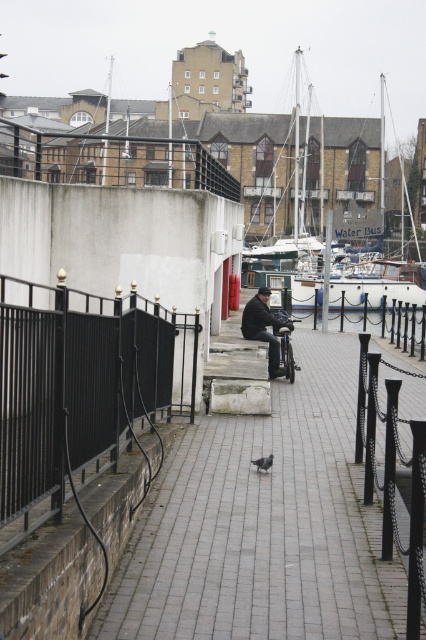
Question: Which of the following is the farthest from the observer?

Choices:
 (A) (255, 465)
 (B) (348, 205)

Answer: (B)

Question: Does gray brick pavement at center have a lesser width compared to white wooden boat at center?

Choices:
 (A) yes
 (B) no

Answer: (A)

Question: Can you confirm if gray brick pavement at center is thinner than gray matte pigeon at center?

Choices:
 (A) yes
 (B) no

Answer: (B)

Question: Considering the relative positions of black metal fence at left and dark gray fabric jacket at center in the image provided, where is black metal fence at left located with respect to dark gray fabric jacket at center?

Choices:
 (A) below
 (B) above

Answer: (A)

Question: Based on their relative distances, which object is nearer to the black metal fence at left?

Choices:
 (A) gray matte pigeon at center
 (B) white wooden boat at center
 (C) gray brick pavement at center
 (D) dark gray fabric jacket at center

Answer: (A)

Question: Among these points, which one is farthest from the camera?

Choices:
 (A) (275, 353)
 (B) (340, 500)
 (C) (345, 211)

Answer: (C)